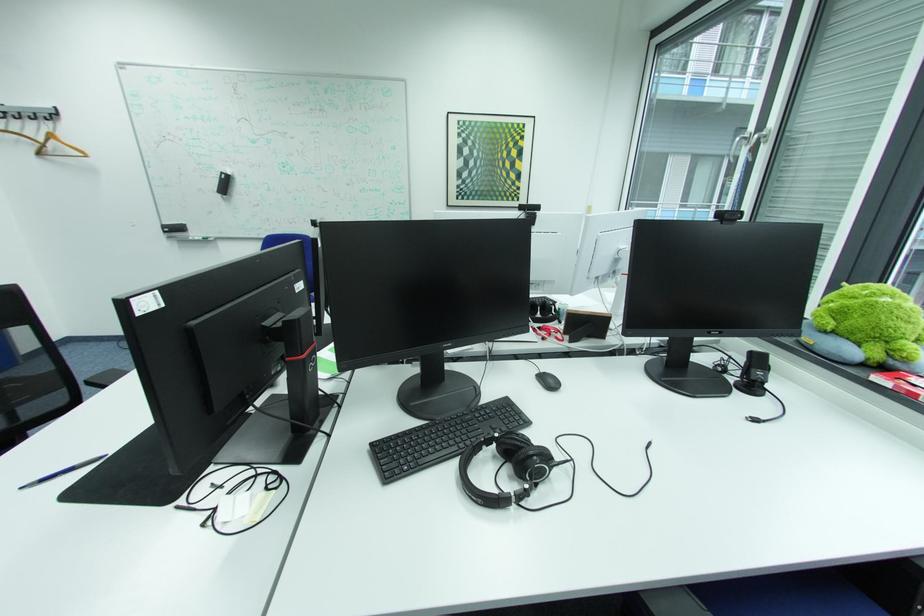
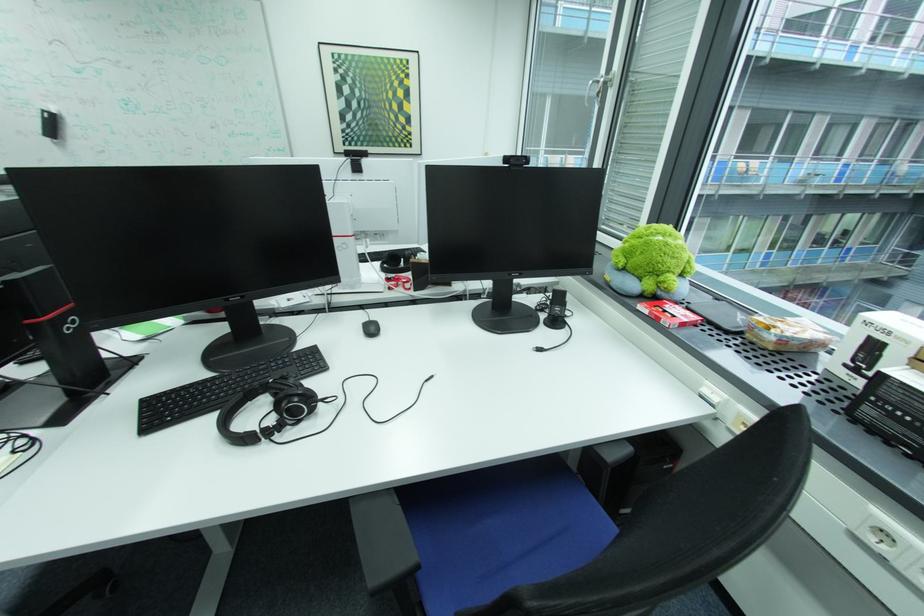
Where in the second image is the point corresponding to [718,333] from the first image?

(518, 275)